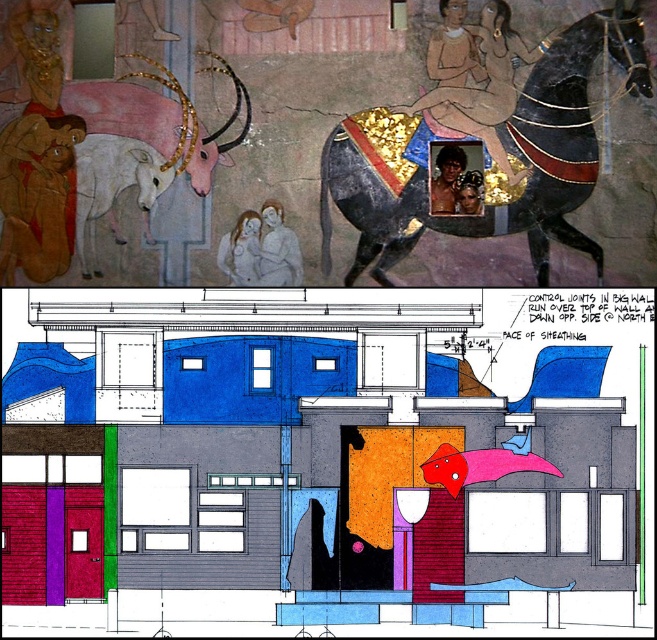
Question: Is matte gold armor at upper center bigger than shiny gold necklace at upper center?

Choices:
 (A) no
 (B) yes

Answer: (B)

Question: Estimate the real-world distances between objects in this image. Which object is farther from the shiny gold necklace at upper center?

Choices:
 (A) matte gold armor at upper center
 (B) shiny black horse at upper right

Answer: (A)

Question: Which object is the farthest from the smooth gray figure at center?

Choices:
 (A) matte gold armor at upper center
 (B) smooth white figure at center
 (C) shiny black horse at upper right
 (D) shiny gold necklace at upper center

Answer: (A)

Question: Is shiny black horse at upper right to the left of smooth white figure at center from the viewer's perspective?

Choices:
 (A) no
 (B) yes

Answer: (A)

Question: Estimate the real-world distances between objects in this image. Which object is closer to the shiny gold necklace at upper center?

Choices:
 (A) shiny black horse at upper right
 (B) matte gold armor at upper center
 (C) smooth gray figure at center

Answer: (A)

Question: Does matte gold armor at upper center have a lesser width compared to shiny gold necklace at upper center?

Choices:
 (A) no
 (B) yes

Answer: (A)